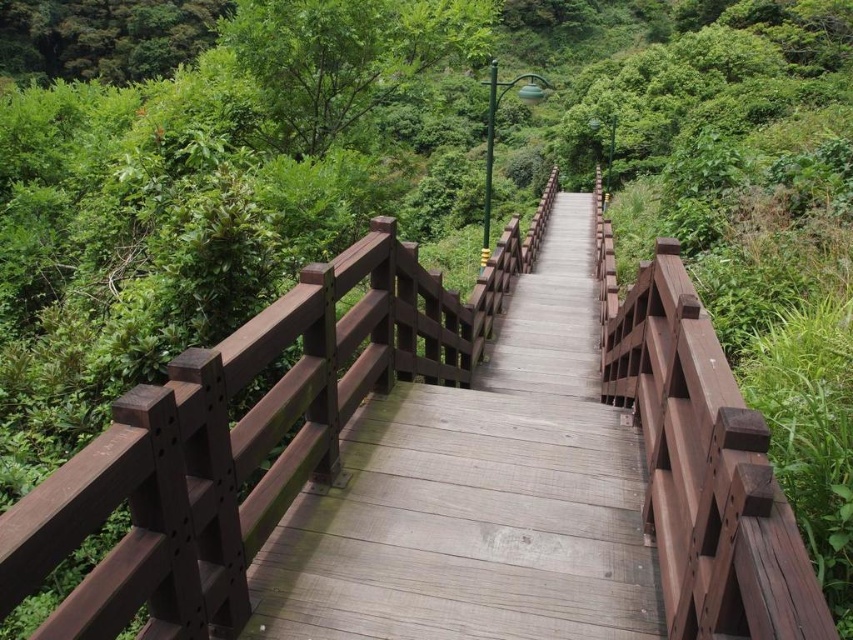
Question: Which object is positioned farthest from the wooden bridge at center?

Choices:
 (A) green leafy tree at upper left
 (B) green leafy tree at upper center

Answer: (A)

Question: Does green leafy tree at upper center have a smaller size compared to green leafy tree at upper left?

Choices:
 (A) yes
 (B) no

Answer: (A)

Question: Which is nearer to the green leafy tree at upper left?

Choices:
 (A) wooden bridge at center
 (B) green leafy tree at upper center

Answer: (A)

Question: Does wooden bridge at center have a greater width compared to green leafy tree at upper center?

Choices:
 (A) yes
 (B) no

Answer: (A)

Question: In this image, where is green leafy tree at upper center located relative to green leafy tree at upper left?

Choices:
 (A) left
 (B) right

Answer: (B)

Question: Which point is closer to the camera?

Choices:
 (A) (4, 44)
 (B) (585, 524)

Answer: (B)